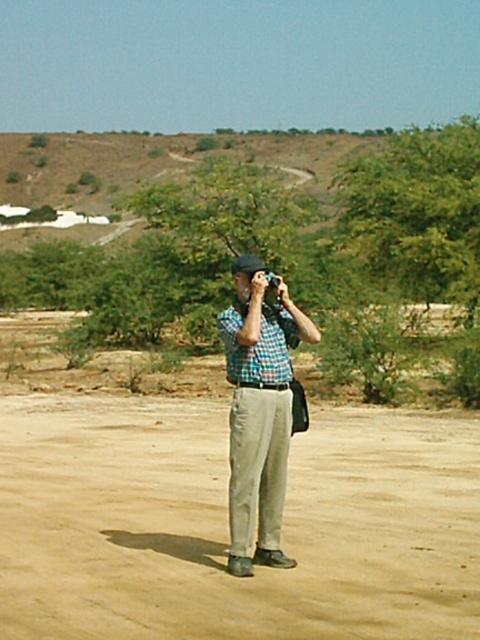
You are a photographer trying to capture the tan sandy ground at center and the checkered fabric shirt at center in your frame. Which object should you position to the left side of your camera viewfinder to include both in the shot?

You should position the checkered fabric shirt at center to the left side of your camera viewfinder because the tan sandy ground at center is located to the right of it.